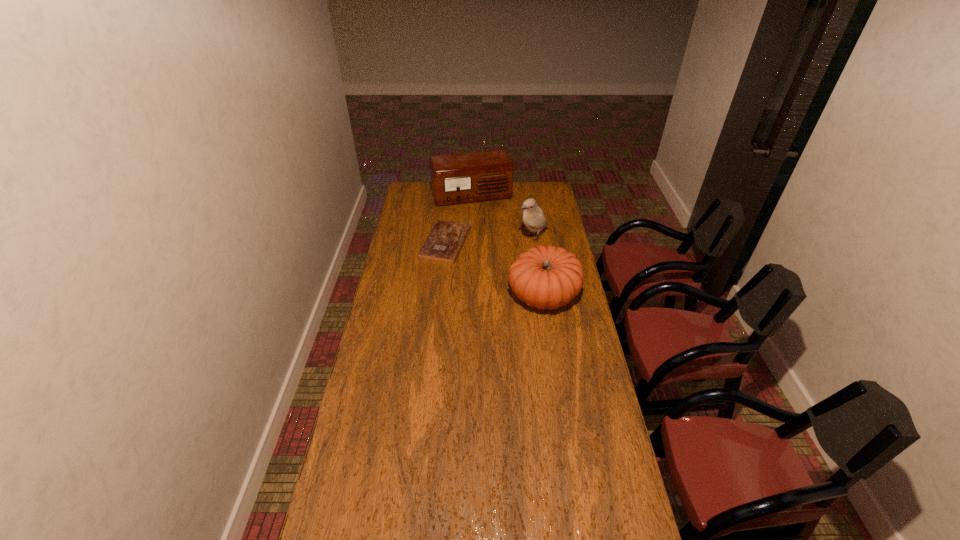
Locate an element on the screen. the shortest object is located at coordinates (445, 241).

I want to click on the nearest object, so click(x=546, y=277).

This screenshot has width=960, height=540. In order to click on the farthest object in this screenshot , I will do `click(462, 178)`.

The width and height of the screenshot is (960, 540). Find the location of `bird`. bird is located at coordinates (533, 218).

Where is `free space located 0.350m on the right of the shortest object`? The width and height of the screenshot is (960, 540). free space located 0.350m on the right of the shortest object is located at coordinates (538, 242).

The height and width of the screenshot is (540, 960). In order to click on vacant region located on the left of the nearest object in this screenshot , I will do `click(469, 295)`.

The width and height of the screenshot is (960, 540). I want to click on free space located 0.380m on the front-facing side of the farthest object, so click(x=495, y=247).

The width and height of the screenshot is (960, 540). In order to click on vacant space located on the front-facing side of the farthest object in this screenshot , I will do `click(491, 235)`.

I want to click on vacant area situated on the front-facing side of the farthest object, so click(x=488, y=226).

At what (x,y) coordinates should I click in order to perform the action: click on free location located 0.170m at the beak of the bird. Please return your answer as a coordinate pair (x, y). Looking at the image, I should click on (499, 260).